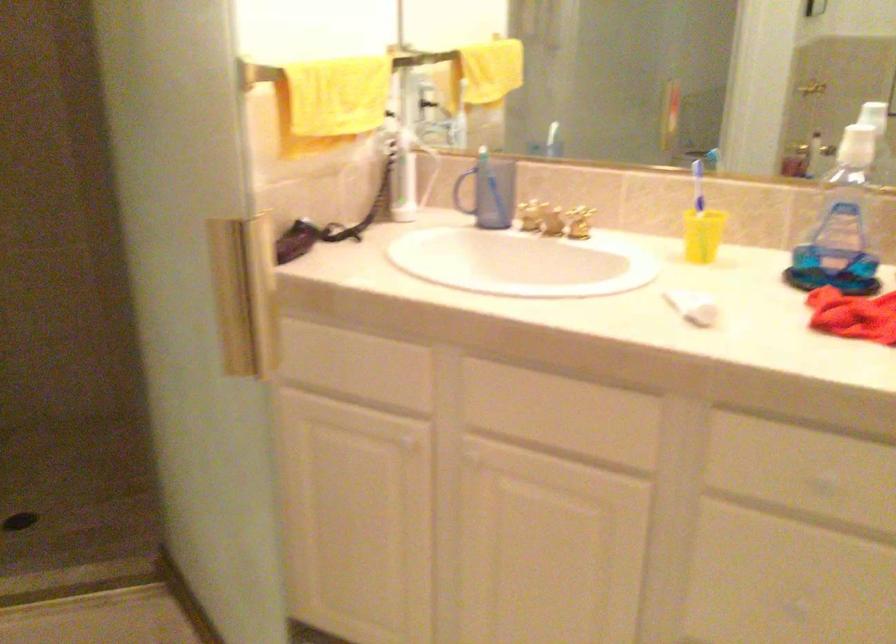
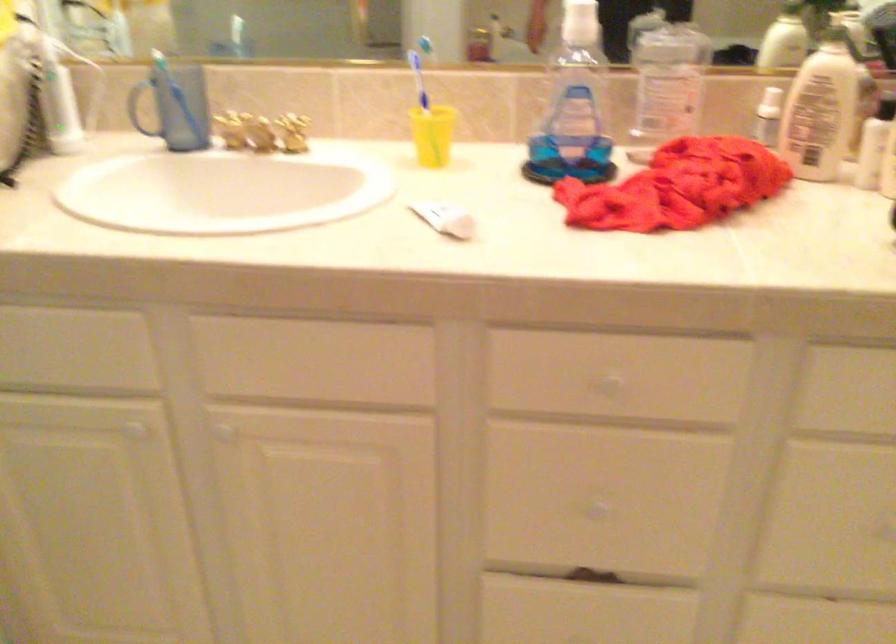
Where in the second image is the point corresponding to (545,218) from the first image?

(259, 131)